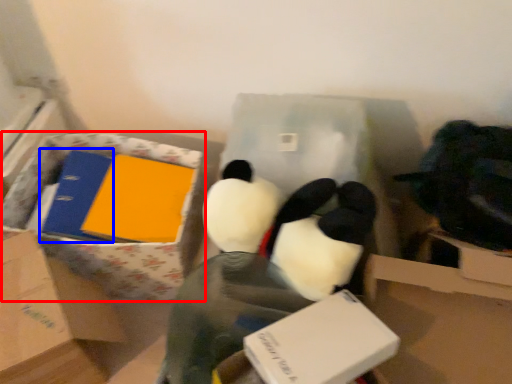
Question: Which object is further to the camera taking this photo, cardboard box (highlighted by a red box) or binder (highlighted by a blue box)?

Choices:
 (A) cardboard box
 (B) binder

Answer: (B)